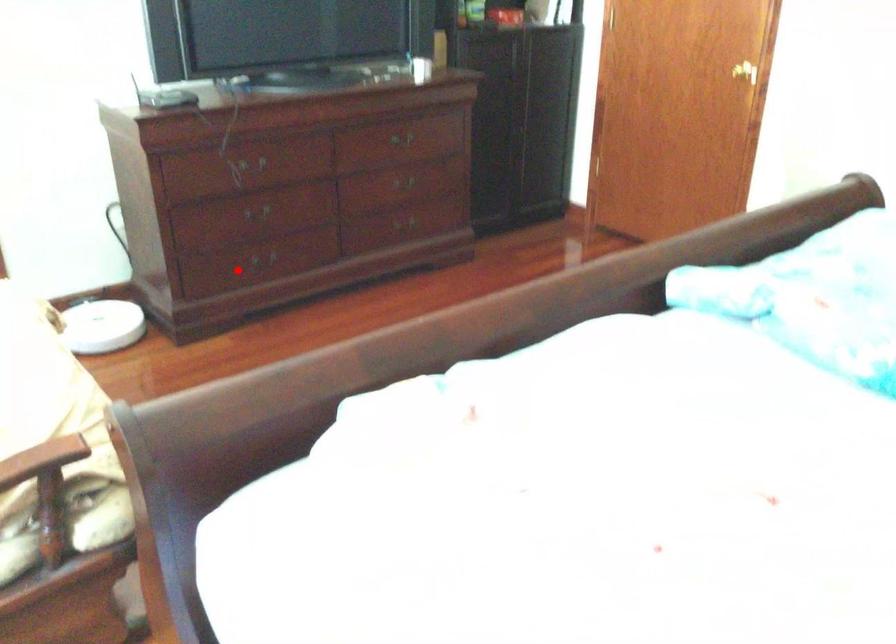
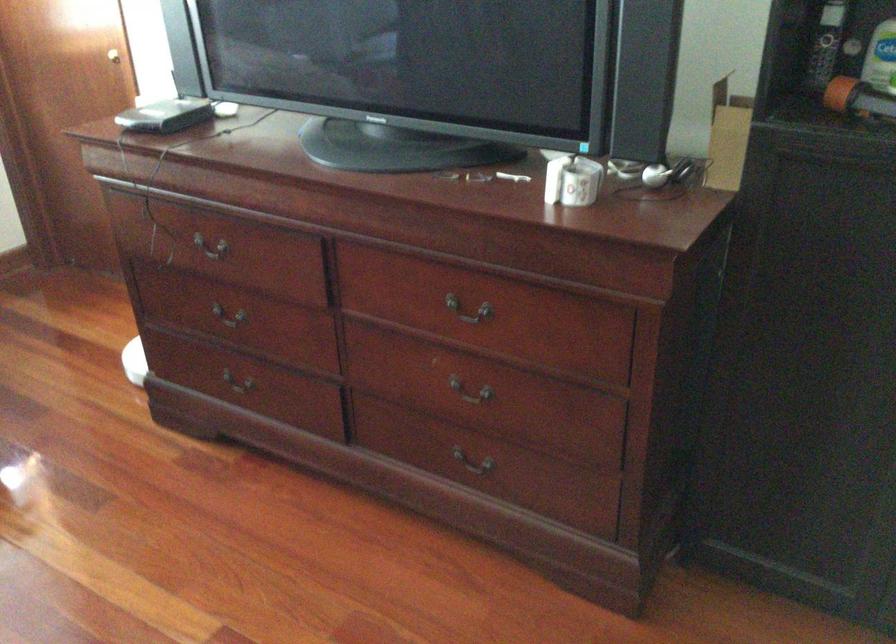
Question: I am providing you with two images of the same scene from different viewpoints. Given a red point in image1, look at the same physical point in image2. Is it:

Choices:
 (A) Closer to the viewpoint
 (B) Farther from the viewpoint

Answer: (A)